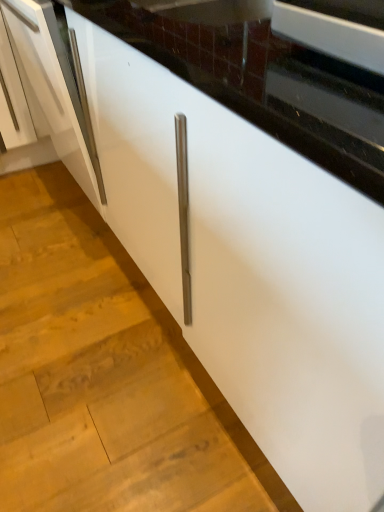
The image size is (384, 512). What do you see at coordinates (272, 70) in the screenshot? I see `black glossy countertop at upper center` at bounding box center [272, 70].

Locate an element on the screen. This screenshot has height=512, width=384. black glossy countertop at upper center is located at coordinates (272, 70).

Locate an element on the screen. This screenshot has width=384, height=512. black glossy countertop at upper center is located at coordinates (272, 70).